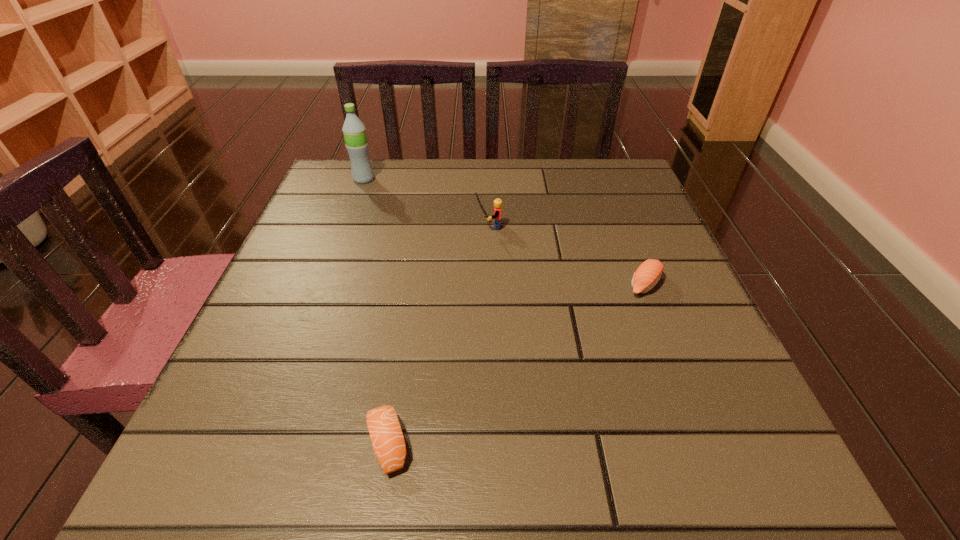
The height and width of the screenshot is (540, 960). I want to click on free space located 0.370m on the front-facing side of the third shortest object, so click(307, 227).

Identify the location of blank space located 0.310m on the front-facing side of the third shortest object. (334, 227).

Find the location of a particular element. vacant space positioned on the front of the farther sushi is located at coordinates (696, 414).

Where is `vacant area situated on the back of the left sushi`? The image size is (960, 540). vacant area situated on the back of the left sushi is located at coordinates (412, 294).

Where is `object situated at the far edge`? object situated at the far edge is located at coordinates (354, 131).

The height and width of the screenshot is (540, 960). I want to click on object situated at the near edge, so click(x=389, y=446).

At what (x,y) coordinates should I click in order to perform the action: click on object that is at the left edge. Please return your answer as a coordinate pair (x, y). Image resolution: width=960 pixels, height=540 pixels. Looking at the image, I should click on (354, 131).

In order to click on object that is at the right edge in this screenshot , I will do `click(647, 275)`.

At what (x,y) coordinates should I click in order to perform the action: click on object that is at the far left corner. Please return your answer as a coordinate pair (x, y). Looking at the image, I should click on (354, 131).

In the image, there is a desktop. Where is `free space at the far edge`? The image size is (960, 540). free space at the far edge is located at coordinates (540, 193).